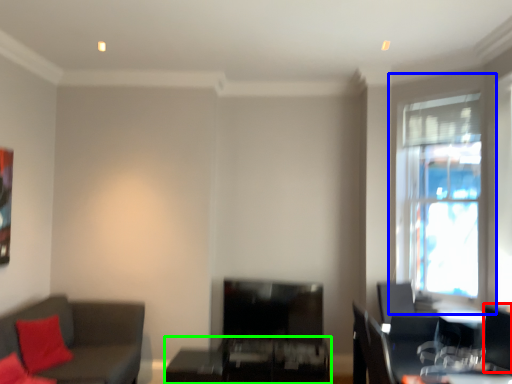
Question: Considering the real-world distances, which object is closest to swivel chair (highlighted by a red box)? window (highlighted by a blue box) or table (highlighted by a green box).

Choices:
 (A) window
 (B) table

Answer: (A)